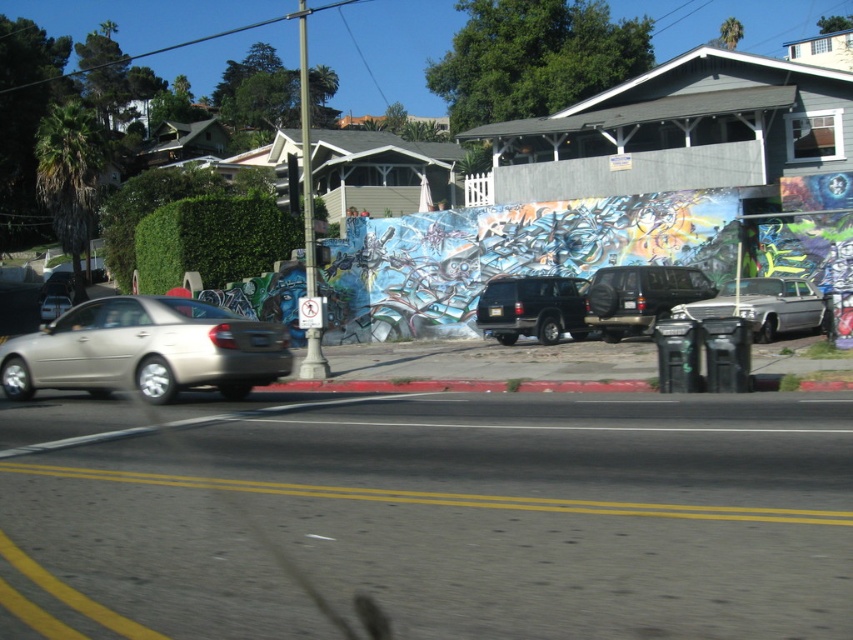
Between satin black suv at center and silver metallic car at right, which one appears on the left side from the viewer's perspective?

satin black suv at center is more to the left.

Is satin black suv at center below silver metallic car at right?

Yes.

Is point (485, 307) behind point (814, 310)?

Yes, it is.

In order to click on satin black suv at center in this screenshot , I will do `click(532, 308)`.

Between satin gold sedan at center and silver metallic car at right, which one appears on the left side from the viewer's perspective?

satin gold sedan at center

Can you confirm if satin gold sedan at center is positioned above silver metallic car at right?

Actually, satin gold sedan at center is below silver metallic car at right.

This screenshot has height=640, width=853. What are the coordinates of `satin gold sedan at center` in the screenshot? It's located at (144, 349).

Does satin gold sedan at center have a greater height compared to matte black suv at center?

No, satin gold sedan at center is not taller than matte black suv at center.

Can you confirm if satin gold sedan at center is wider than matte black suv at center?

Correct, the width of satin gold sedan at center exceeds that of matte black suv at center.

Locate an element on the screen. satin gold sedan at center is located at coordinates click(144, 349).